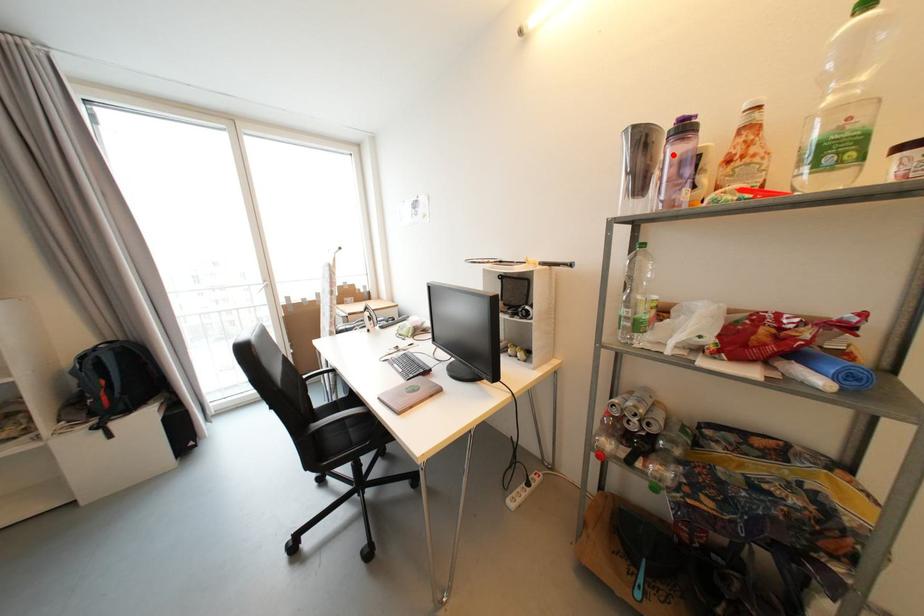
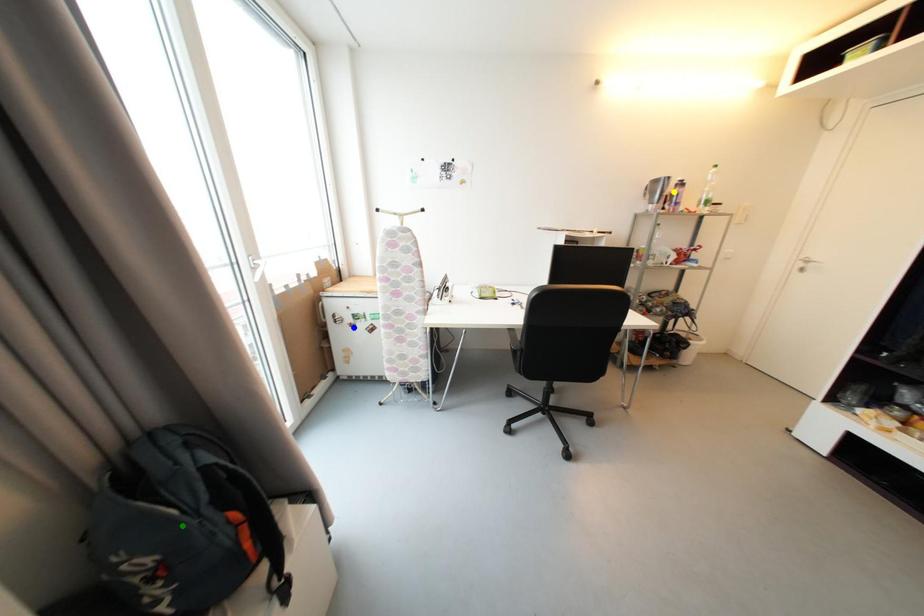
Question: I am providing you with two images of the same scene from different viewpoints. A red point is marked on the first image. You are given multiple points on the second image. Which mark in image 2 goes with the point in image 1?

Choices:
 (A) yellow point
 (B) green point
 (C) blue point

Answer: (A)